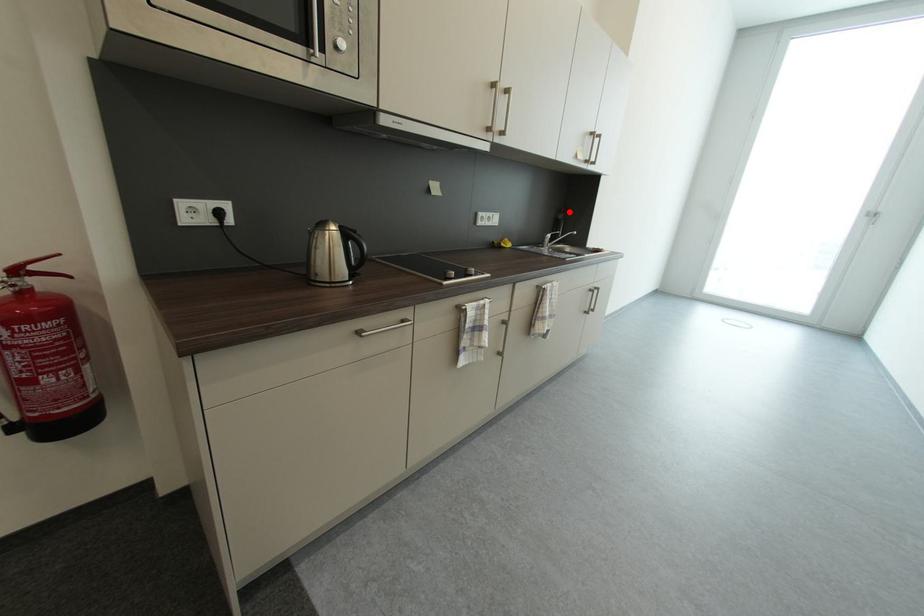
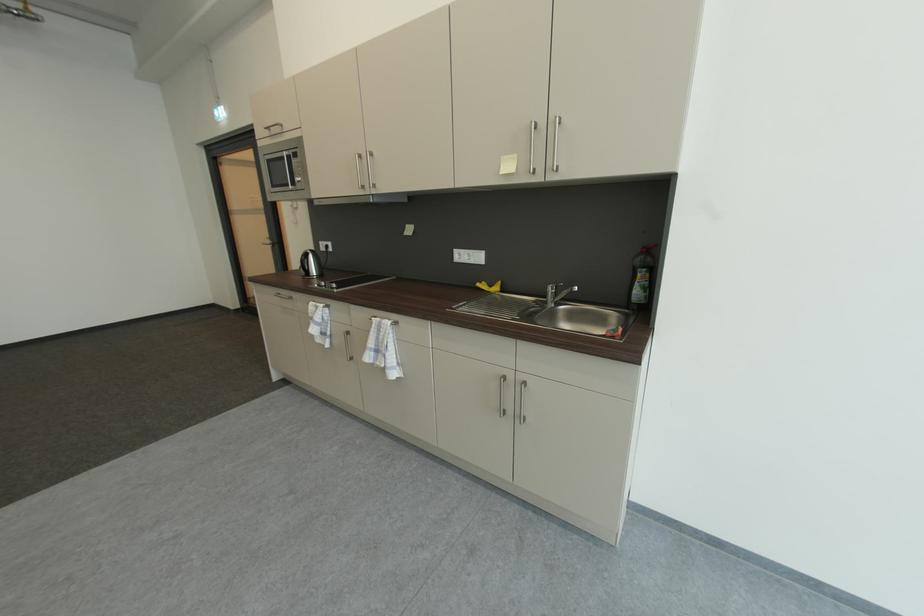
Find the pixel in the second image that matches the highlighted location in the first image.

(650, 252)